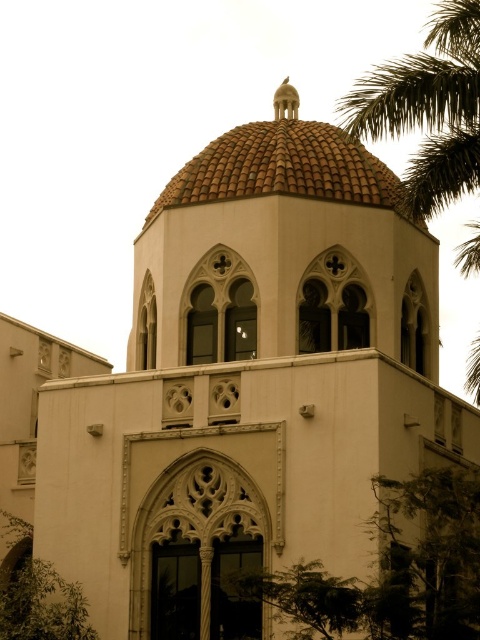
Which is above, green leafy tree at lower right or brown tiled dome at upper center?

Positioned higher is brown tiled dome at upper center.

Which of these two, green leafy tree at lower right or brown tiled dome at upper center, stands taller?

brown tiled dome at upper center is taller.

Identify the location of green leafy tree at lower right. The height and width of the screenshot is (640, 480). (392, 568).

This screenshot has height=640, width=480. I want to click on green leafy tree at lower right, so click(392, 568).

Between green leafy palm tree at upper right and brown tiled dome at upper center, which one appears on the right side from the viewer's perspective?

green leafy palm tree at upper right is more to the right.

Measure the distance between green leafy palm tree at upper right and brown tiled dome at upper center.

green leafy palm tree at upper right is 13.51 meters away from brown tiled dome at upper center.

What do you see at coordinates (428, 108) in the screenshot?
I see `green leafy palm tree at upper right` at bounding box center [428, 108].

Find the location of a particular element. This screenshot has width=480, height=640. green leafy palm tree at upper right is located at coordinates (428, 108).

Is green leafy tree at lower right above green leafy palm tree at upper right?

No, green leafy tree at lower right is not above green leafy palm tree at upper right.

Is point (315, 636) in front of point (420, 54)?

Yes, point (315, 636) is closer to viewer.

I want to click on green leafy tree at lower right, so click(392, 568).